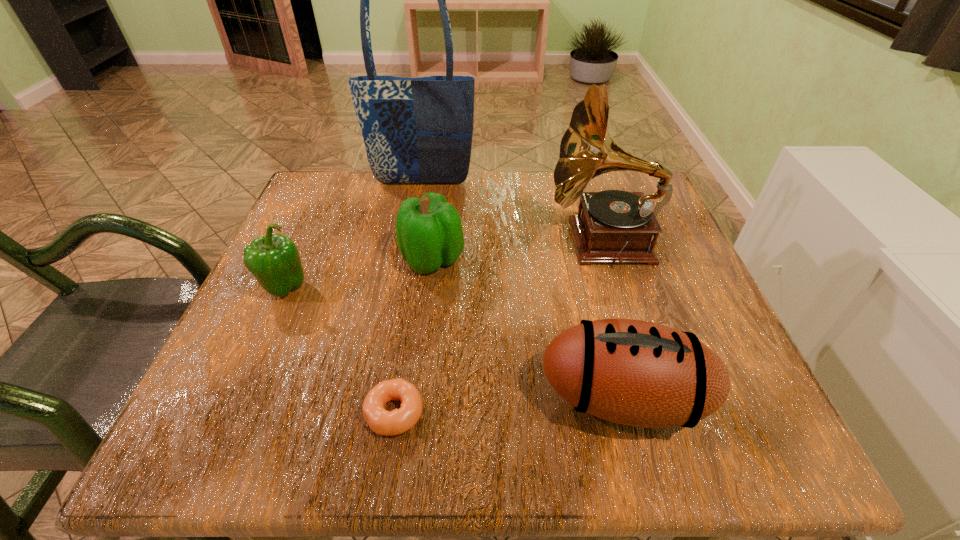
In the image, there is a desktop. Where is `free space at the near right corner`? The height and width of the screenshot is (540, 960). free space at the near right corner is located at coordinates (740, 424).

Where is `vacant space that is in between the leftmost object and the right bell pepper`? This screenshot has height=540, width=960. vacant space that is in between the leftmost object and the right bell pepper is located at coordinates (358, 274).

Locate an element on the screen. The height and width of the screenshot is (540, 960). free area in between the farthest object and the football (American) is located at coordinates (522, 291).

Locate an element on the screen. This screenshot has height=540, width=960. vacant space that is in between the football (American) and the right bell pepper is located at coordinates (527, 329).

You are a GUI agent. You are given a task and a screenshot of the screen. Output one action in this format:
    pyautogui.click(x=<x>, y=<y>)
    Task: Click on the empty space that is in between the shopping bag and the football (American)
    This screenshot has width=960, height=540.
    Given the screenshot: What is the action you would take?
    pyautogui.click(x=522, y=291)

In order to click on free space between the football (American) and the tallest object in this screenshot , I will do `click(522, 291)`.

This screenshot has height=540, width=960. Find the location of `empty space between the shortest object and the football (American)`. empty space between the shortest object and the football (American) is located at coordinates point(509,405).

Find the location of a particular element. This screenshot has height=540, width=960. empty space between the tallest object and the doughnut is located at coordinates (408, 298).

Locate an element on the screen. The height and width of the screenshot is (540, 960). vacant space that's between the phonograph_record and the doughnut is located at coordinates (498, 326).

Identify the location of object that is the closest to the leftmost object. (429, 233).